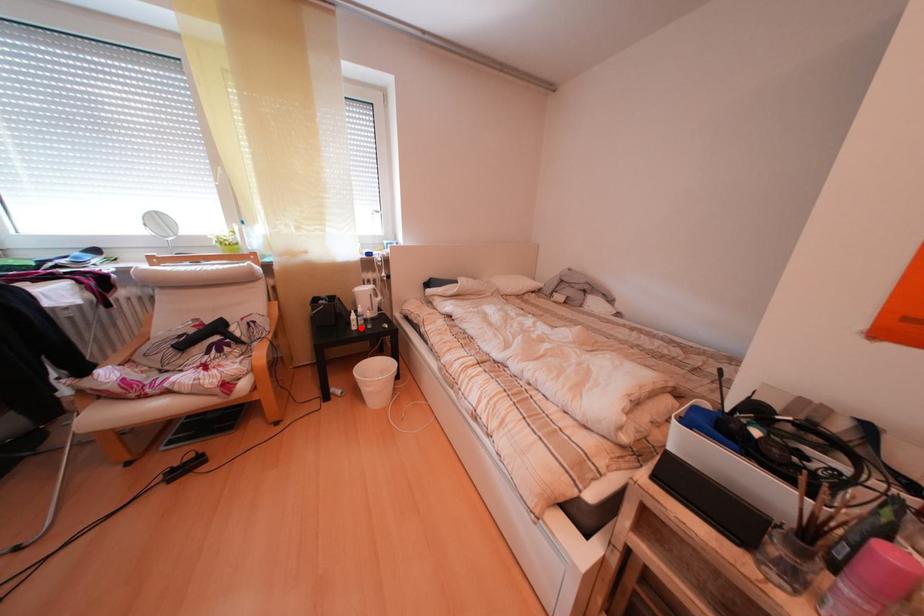
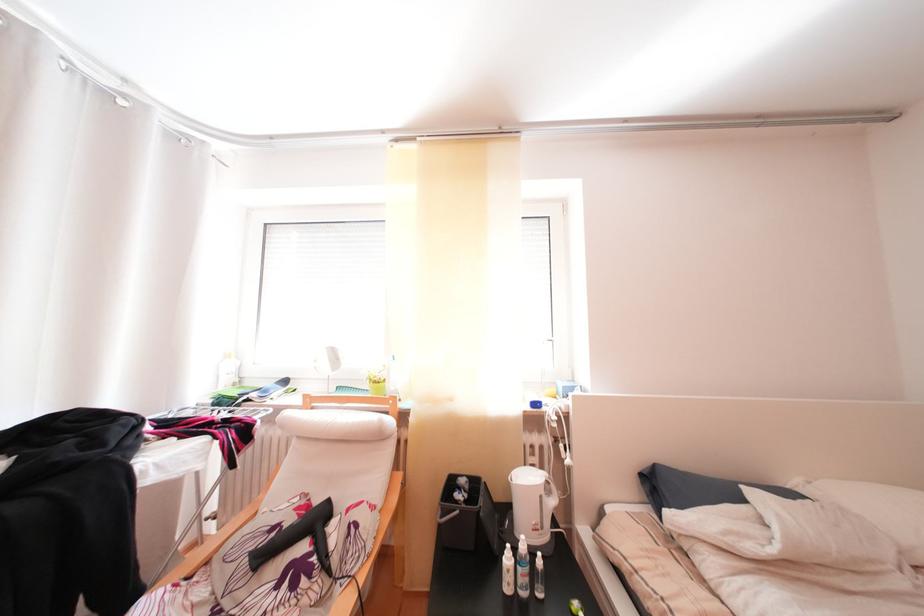
Question: I am providing you with two images of the same scene from different viewpoints. Given a red point in image1, look at the same physical point in image2. Is it:

Choices:
 (A) Closer to the viewpoint
 (B) Farther from the viewpoint

Answer: (B)